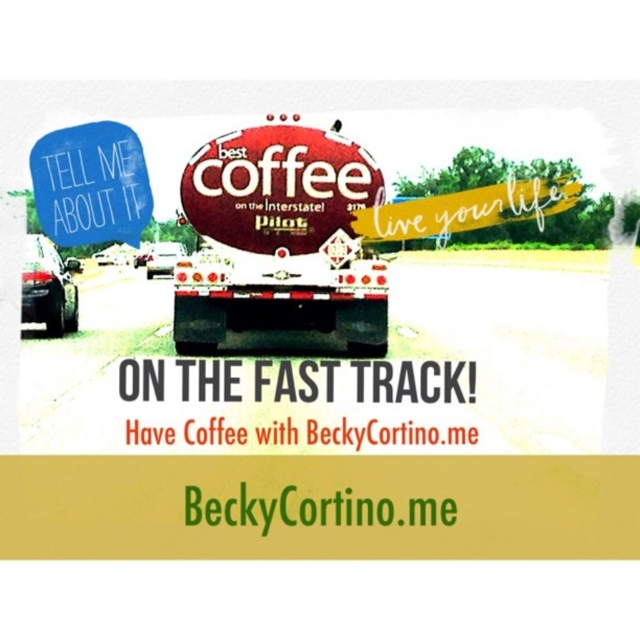
You are a truck driver approaching the scene shown in the image. You see a metallic red stop sign at center and a white glossy trailer truck at center. Which object is positioned to the right of the other?

The metallic red stop sign at center is positioned to the right of the white glossy trailer truck at center.

You are standing 10 meters away from the image. Is the point at coordinates point (209,273) closer to you or farther than your current distance?

The point at coordinates point (209,273) is 11.54 meters away from the viewer, which is farther than your current 10 meters distance.